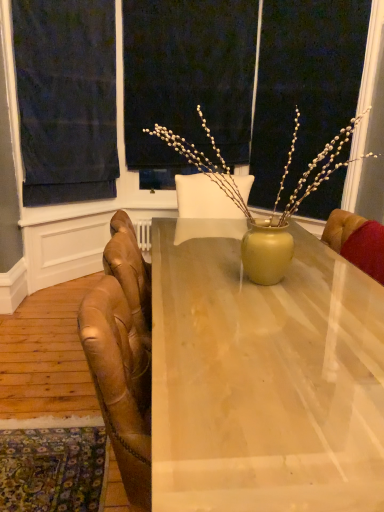
Question: Is dark blue fabric at upper left in contact with leather armchair at right?

Choices:
 (A) no
 (B) yes

Answer: (A)

Question: Considering the relative positions of dark blue fabric at upper left and leather armchair at right in the image provided, is dark blue fabric at upper left in front of leather armchair at right?

Choices:
 (A) yes
 (B) no

Answer: (B)

Question: Is the depth of dark blue fabric at upper left greater than that of leather armchair at right?

Choices:
 (A) yes
 (B) no

Answer: (A)

Question: From a real-world perspective, does dark blue fabric at upper left sit lower than leather armchair at right?

Choices:
 (A) yes
 (B) no

Answer: (B)

Question: From a real-world perspective, is dark blue fabric at upper left positioned over leather armchair at right based on gravity?

Choices:
 (A) no
 (B) yes

Answer: (B)

Question: In the image, is matte wood desk at center positioned in front of or behind leather armchair at right?

Choices:
 (A) behind
 (B) front

Answer: (B)

Question: Would you say matte wood desk at center is inside or outside leather armchair at right?

Choices:
 (A) inside
 (B) outside

Answer: (B)

Question: Is point (226, 360) closer or farther from the camera than point (364, 267)?

Choices:
 (A) farther
 (B) closer

Answer: (B)

Question: From a real-world perspective, is matte wood desk at center physically located above or below leather armchair at right?

Choices:
 (A) below
 (B) above

Answer: (A)

Question: Based on their sizes in the image, would you say dark blue fabric at upper left is bigger or smaller than matte black screen at upper center?

Choices:
 (A) small
 (B) big

Answer: (A)

Question: Relative to matte black screen at upper center, is dark blue fabric at upper left in front or behind?

Choices:
 (A) front
 (B) behind

Answer: (A)

Question: From the image's perspective, is dark blue fabric at upper left above or below matte black screen at upper center?

Choices:
 (A) below
 (B) above

Answer: (A)

Question: From their relative heights in the image, would you say dark blue fabric at upper left is taller or shorter than matte black screen at upper center?

Choices:
 (A) tall
 (B) short

Answer: (A)

Question: From a real-world perspective, relative to matte black screen at upper center, is leather armchair at right vertically above or below?

Choices:
 (A) above
 (B) below

Answer: (B)

Question: In terms of size, does leather armchair at right appear bigger or smaller than matte black screen at upper center?

Choices:
 (A) big
 (B) small

Answer: (B)